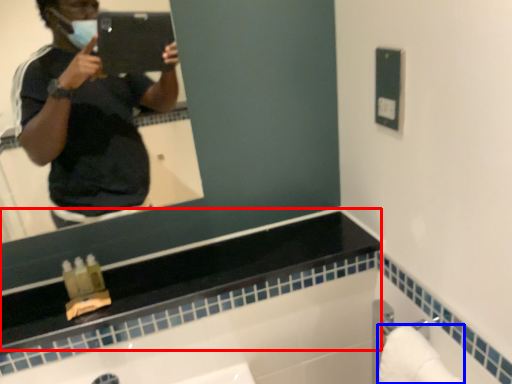
Question: Which of the following is the closest to the observer, counter top (highlighted by a red box) or towel bar (highlighted by a blue box)?

Choices:
 (A) counter top
 (B) towel bar

Answer: (B)